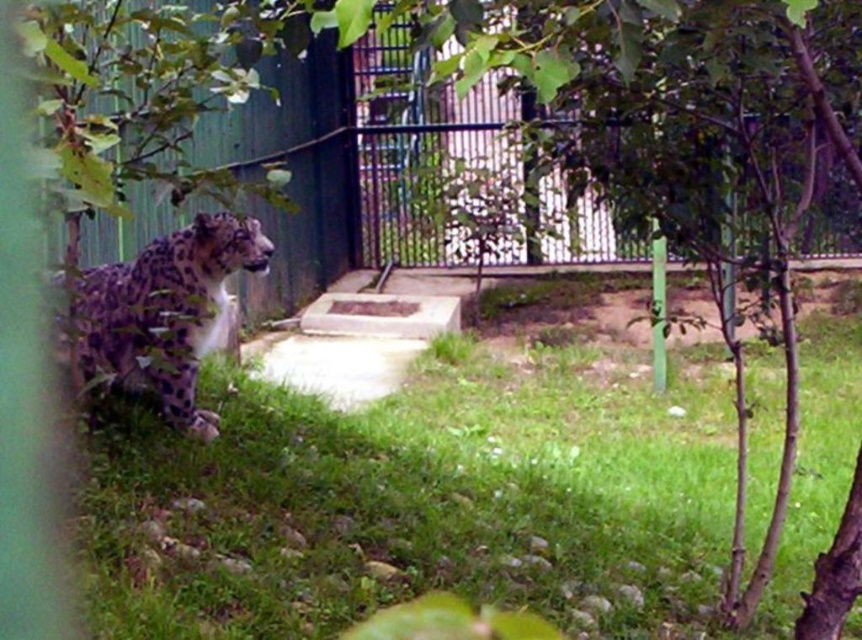
You are a zookeeper who needs to secure the metallic gate at center. However, the spotted fur leopard at left is blocking your path. Can you reach the gate without disturbing the leopard?

The metallic gate at center is located above the spotted fur leopard at left, so you can reach it without needing to move the leopard as it is positioned higher up.

You are a zookeeper observing the enclosure. You notice the green leafy tree at center and the spotted fur leopard at left. Which object is positioned higher in the image?

The green leafy tree at center is located above the spotted fur leopard at left, so it is positioned higher in the image.

You are a zookeeper trying to locate a specific point in the snow leopard enclosure. The point you need to find is labeled as point (x=417, y=502). Based on the scene description, where would this point be located?

The point (x=417, y=502) is on the green grass at lower center of the enclosure.